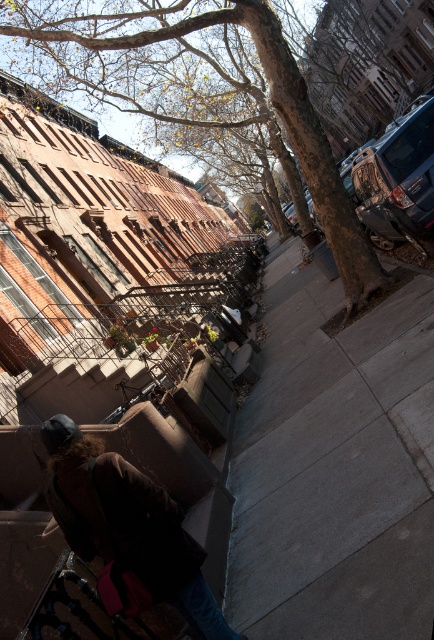
Does gray concrete sidewalk at center appear over dark brown leather jacket at lower left?

Yes.

Is gray concrete sidewalk at center positioned in front of dark brown leather jacket at lower left?

That is True.

I want to click on gray concrete sidewalk at center, so click(x=335, y=467).

Can you confirm if gray concrete sidewalk at center is taller than brown textured tree at upper center?

No, gray concrete sidewalk at center is not taller than brown textured tree at upper center.

Who is lower down, gray concrete sidewalk at center or brown textured tree at upper center?

Positioned lower is gray concrete sidewalk at center.

Describe the element at coordinates (335, 467) in the screenshot. I see `gray concrete sidewalk at center` at that location.

What are the coordinates of `gray concrete sidewalk at center` in the screenshot? It's located at (335, 467).

Does brown textured tree at upper center have a lesser height compared to dark brown leather jacket at lower left?

Incorrect, brown textured tree at upper center's height does not fall short of dark brown leather jacket at lower left's.

Is brown textured tree at upper center positioned behind dark brown leather jacket at lower left?

Yes, it is behind dark brown leather jacket at lower left.

Who is more distant from viewer, (x=272, y=49) or (x=69, y=506)?

The point (x=272, y=49) is more distant.

Find the location of a particular element. This screenshot has height=640, width=434. brown textured tree at upper center is located at coordinates (167, 49).